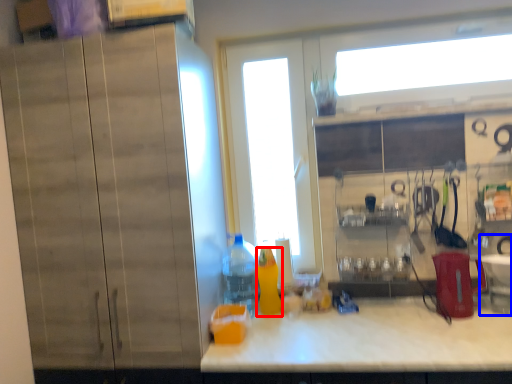
Question: Which object is closer to the camera taking this photo, bottle (highlighted by a red box) or sink (highlighted by a blue box)?

Choices:
 (A) bottle
 (B) sink

Answer: (B)